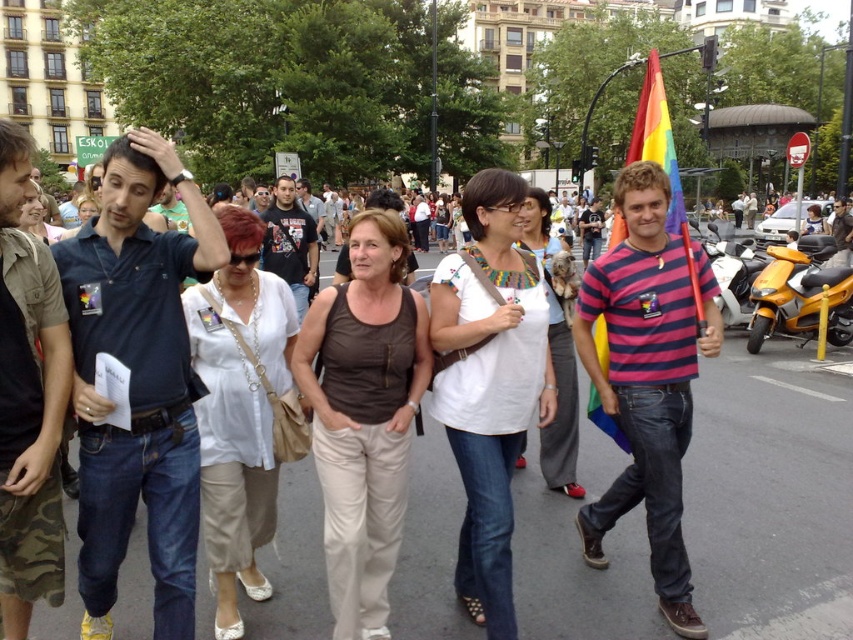
Which is below, striped cotton t-shirt at center or yellow matte scooter at center?

striped cotton t-shirt at center is below.

Does striped cotton t-shirt at center appear over yellow matte scooter at center?

Actually, striped cotton t-shirt at center is below yellow matte scooter at center.

Is point (612, 512) less distant than point (715, 252)?

Yes.

Locate an element on the screen. The width and height of the screenshot is (853, 640). striped cotton t-shirt at center is located at coordinates (647, 378).

Is point (560, 321) farther from viewer compared to point (299, 193)?

No, (560, 321) is in front of (299, 193).

Who is higher up, white fabric dress at center or brown cotton tank top at center?

brown cotton tank top at center is higher up.

Who is more forward, (578, 493) or (318, 224)?

Point (578, 493) is in front.

The width and height of the screenshot is (853, 640). Find the location of `white fabric dress at center`. white fabric dress at center is located at coordinates (554, 355).

Does striped cotton t-shirt at center lie in front of brown cotton tank top at center?

Yes, striped cotton t-shirt at center is in front of brown cotton tank top at center.

Which of these two, striped cotton t-shirt at center or brown cotton tank top at center, stands taller?

striped cotton t-shirt at center

Does point (668, 579) come behind point (323, 230)?

No, (668, 579) is in front of (323, 230).

Locate an element on the screen. The width and height of the screenshot is (853, 640). striped cotton t-shirt at center is located at coordinates (647, 378).